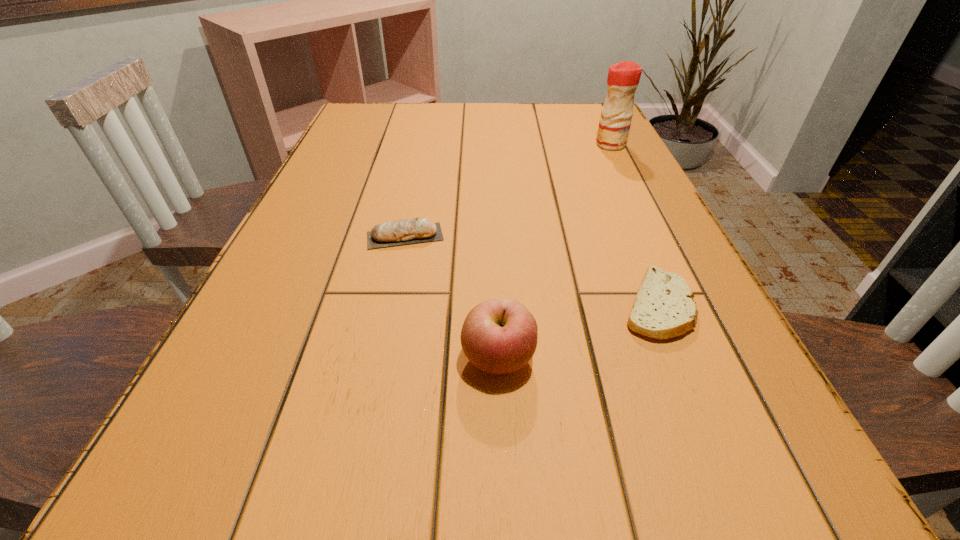
Image resolution: width=960 pixels, height=540 pixels. I want to click on object that is the second closest to the condiment, so click(406, 231).

I want to click on object that is the closest to the shorter pita bread, so click(499, 336).

Locate an element on the screen. The height and width of the screenshot is (540, 960). vacant space that satisfies the following two spatial constraints: 1. on the back side of the farthest object; 2. on the left side of the apple is located at coordinates (491, 145).

At what (x,y) coordinates should I click in order to perform the action: click on vacant position in the image that satisfies the following two spatial constraints: 1. on the front side of the second shortest object; 2. on the right side of the second tallest object. Please return your answer as a coordinate pair (x, y). The height and width of the screenshot is (540, 960). Looking at the image, I should click on (379, 358).

Find the location of a particular element. This screenshot has height=540, width=960. vacant space that satisfies the following two spatial constraints: 1. on the back side of the second object from left to right; 2. on the right side of the shortest object is located at coordinates (496, 306).

Where is `vacant space that satisfies the following two spatial constraints: 1. on the back side of the shorter pita bread; 2. on the right side of the second object from left to right`? vacant space that satisfies the following two spatial constraints: 1. on the back side of the shorter pita bread; 2. on the right side of the second object from left to right is located at coordinates (496, 306).

Identify the location of free region that satisfies the following two spatial constraints: 1. on the back side of the shorter pita bread; 2. on the left side of the tallest object. (591, 145).